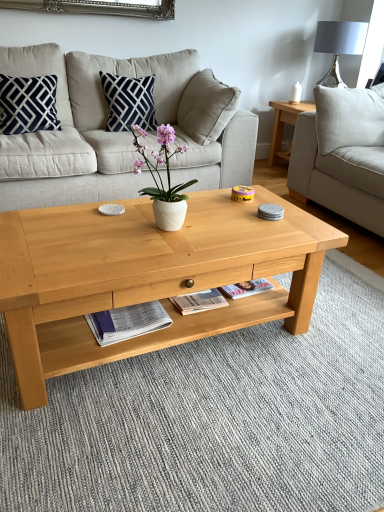
Identify the location of free space in front of natural wood coffee table at center. (175, 439).